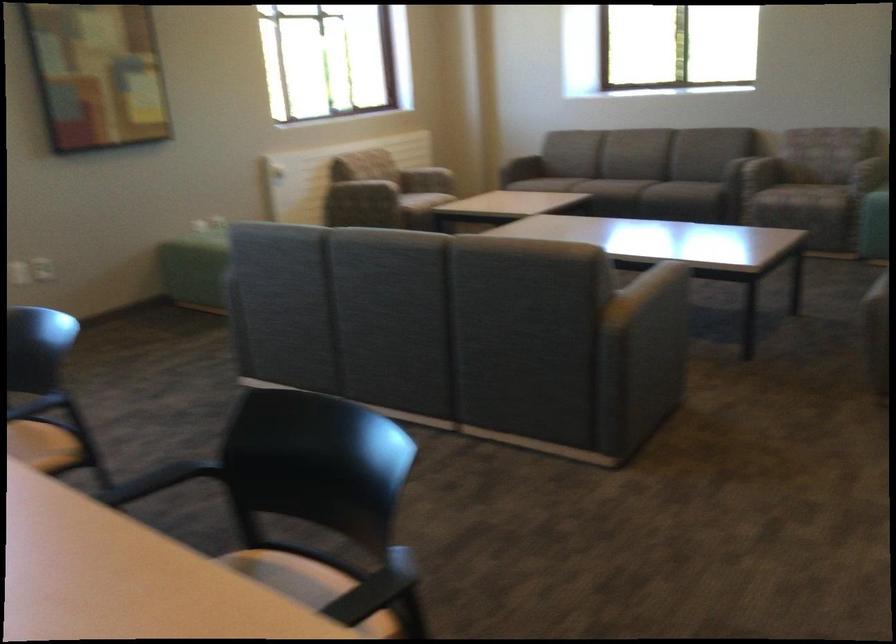
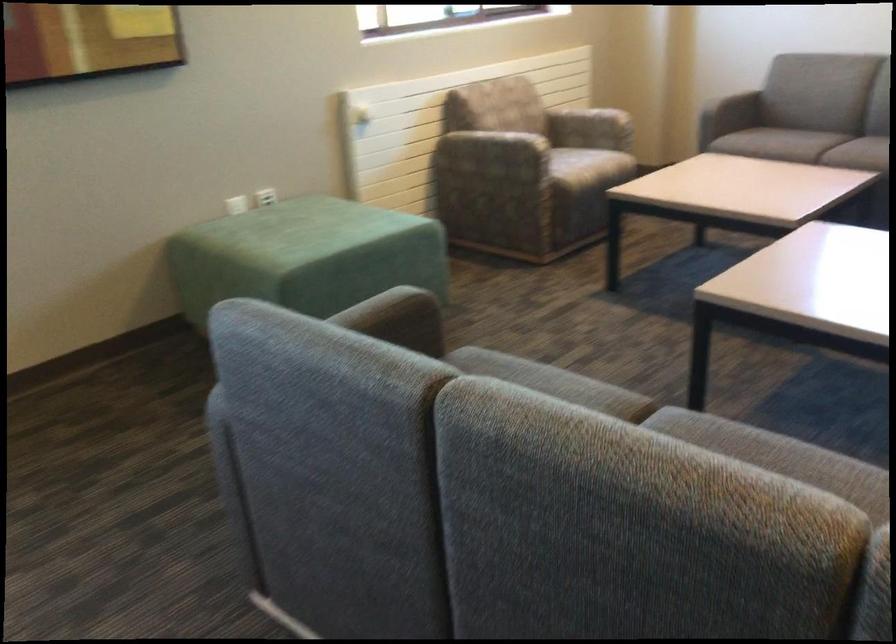
Question: Which direction would the cameraman need to move to produce the second image? Reply with the corresponding letter.

Choices:
 (A) Left
 (B) Right
 (C) Forward
 (D) Backward

Answer: (C)